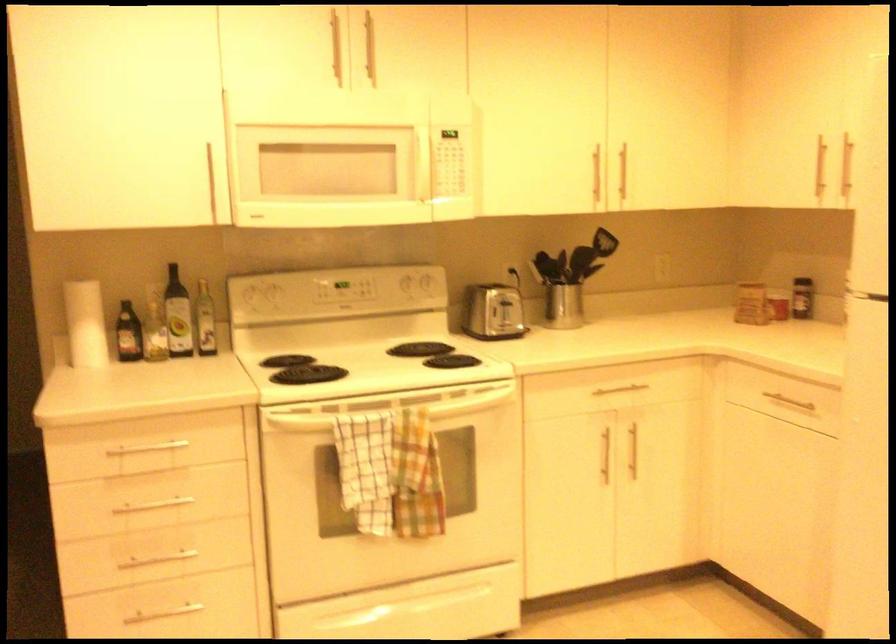
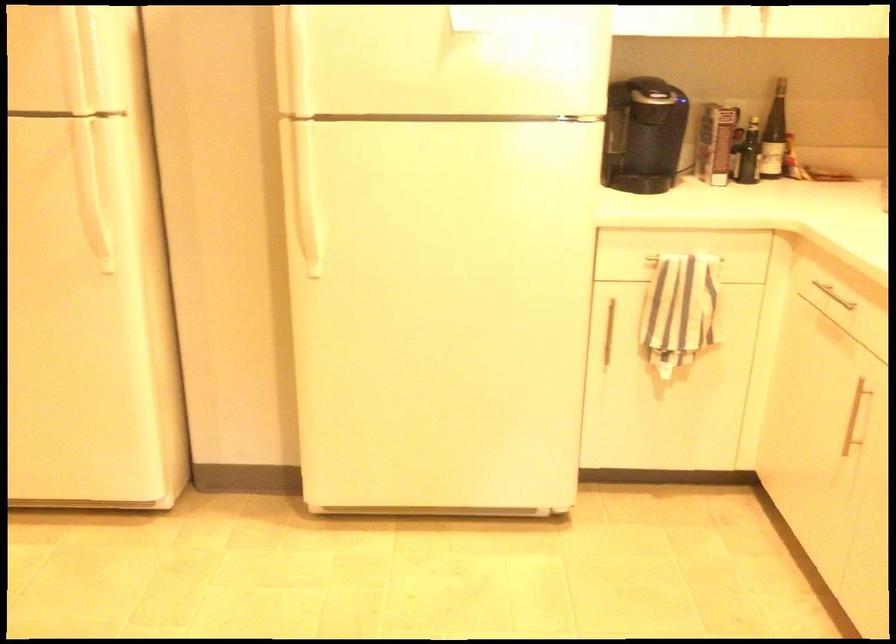
Question: The camera is either moving clockwise (left) or counter-clockwise (right) around the object. The first image is from the beginning of the video and the second image is from the end. Is the camera moving left or right when shooting the video?

Choices:
 (A) Left
 (B) Right

Answer: (A)